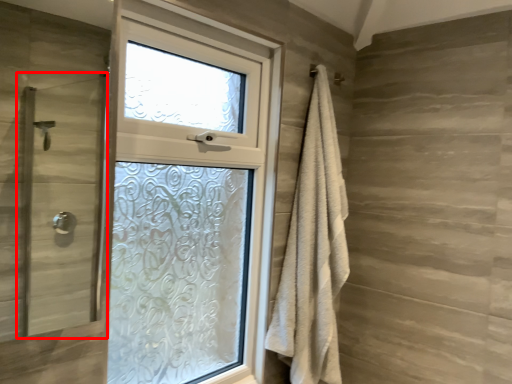
Question: From the image's perspective, what is the correct spatial relationship of screen door (annotated by the red box) in relation to bath towel?

Choices:
 (A) above
 (B) below

Answer: (A)